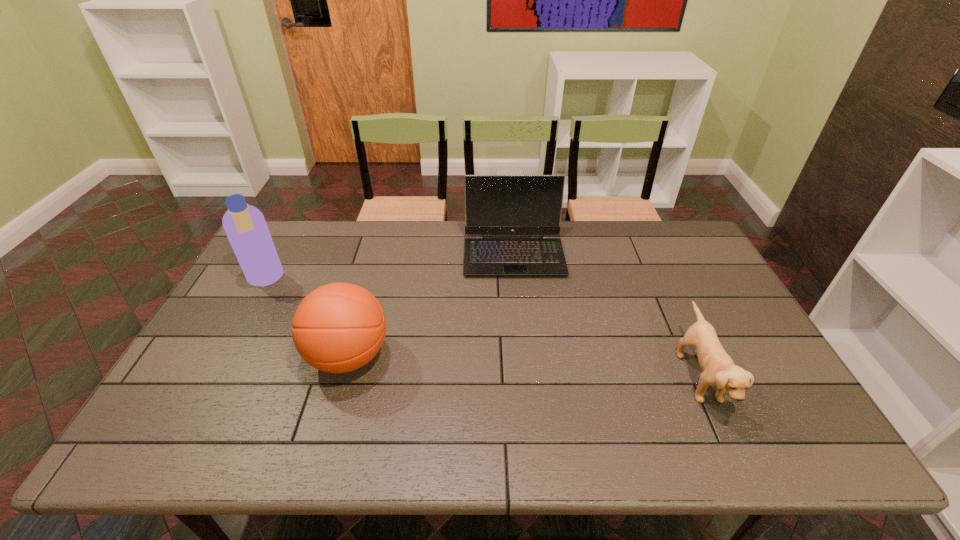
This screenshot has width=960, height=540. What are the coordinates of `vacant area that lies between the leftmost object and the puppy` in the screenshot? It's located at (482, 328).

You are a GUI agent. You are given a task and a screenshot of the screen. Output one action in this format:
    pyautogui.click(x=<x>, y=<y>)
    Task: Click on the vacant area that lies between the laptop computer and the shortest object
    This screenshot has height=540, width=960.
    Given the screenshot: What is the action you would take?
    pyautogui.click(x=606, y=315)

Find the location of a particular element. free spot between the rightmost object and the laptop computer is located at coordinates (606, 315).

Find the location of `vacant area between the basketball and the third object from left to right`. vacant area between the basketball and the third object from left to right is located at coordinates (431, 305).

This screenshot has width=960, height=540. I want to click on vacant space that is in between the laptop computer and the second object from left to right, so click(431, 305).

Where is `vacant area between the basketball and the second object from right to left`? vacant area between the basketball and the second object from right to left is located at coordinates (431, 305).

Locate an element on the screen. The image size is (960, 540). free point between the laptop computer and the tallest object is located at coordinates (390, 267).

The image size is (960, 540). I want to click on vacant space that's between the third object from right to left and the puppy, so click(x=524, y=367).

I want to click on object that stands as the closest to the third object from left to right, so click(339, 327).

You are a GUI agent. You are given a task and a screenshot of the screen. Output one action in this format:
    pyautogui.click(x=<x>, y=<y>)
    Task: Click on the second closest object to the puppy
    
    Given the screenshot: What is the action you would take?
    pyautogui.click(x=339, y=327)